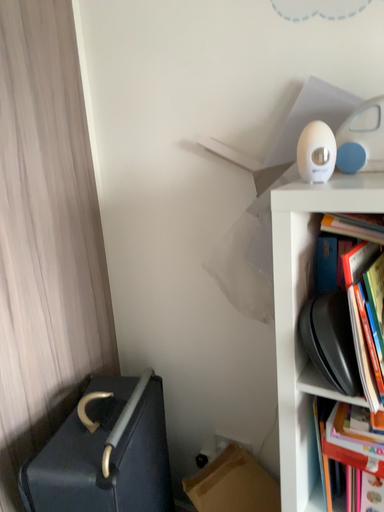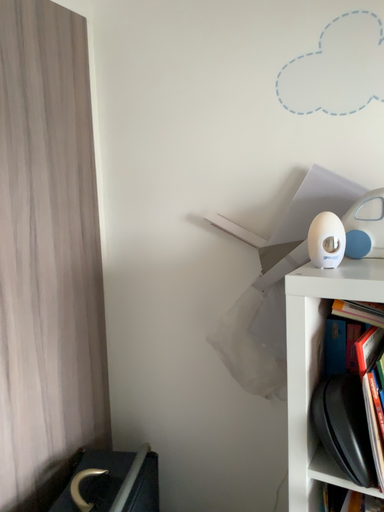
Question: Which way did the camera rotate in the video?

Choices:
 (A) rotated upward
 (B) rotated downward

Answer: (A)